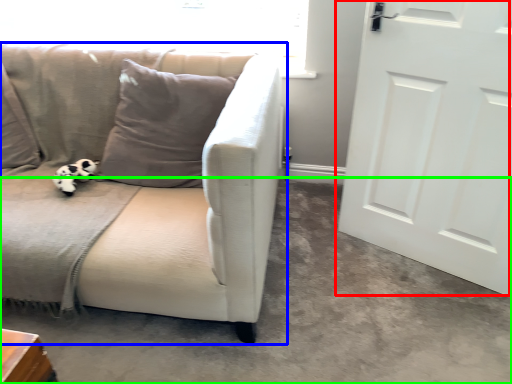
Question: Which is nearer to the door (highlighted by a red box)? studio couch (highlighted by a blue box) or concrete (highlighted by a green box).

Choices:
 (A) studio couch
 (B) concrete

Answer: (B)